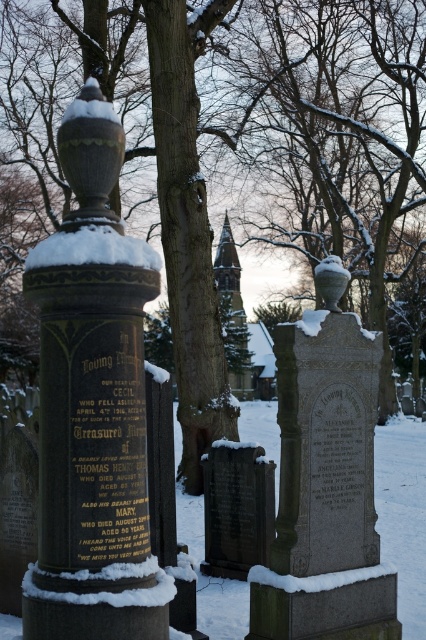
Who is positioned more to the right, granite gravestone at center or white fluffy snow at top?

granite gravestone at center is more to the right.

Is granite gravestone at center bigger than white fluffy snow at top?

Indeed, granite gravestone at center has a larger size compared to white fluffy snow at top.

What do you see at coordinates (325, 483) in the screenshot? This screenshot has width=426, height=640. I see `granite gravestone at center` at bounding box center [325, 483].

Locate an element on the screen. The image size is (426, 640). granite gravestone at center is located at coordinates (325, 483).

Which is behind, point (394, 582) or point (213, 499)?

Point (213, 499)

Can you confirm if granite gravestone at center is positioned to the right of dark gray stone gravestone at center?

Yes, granite gravestone at center is to the right of dark gray stone gravestone at center.

Image resolution: width=426 pixels, height=640 pixels. Describe the element at coordinates (325, 483) in the screenshot. I see `granite gravestone at center` at that location.

What are the coordinates of `granite gravestone at center` in the screenshot? It's located at (325, 483).

Is bronze plaque at center shorter than granite gravestone at center?

Incorrect, bronze plaque at center's height does not fall short of granite gravestone at center's.

Does bronze plaque at center have a greater height compared to granite gravestone at center?

Indeed, bronze plaque at center has a greater height compared to granite gravestone at center.

Is point (132, 636) positioned after point (371, 476)?

No, (132, 636) is closer to viewer.

Identify the location of bronze plaque at center. (92, 404).